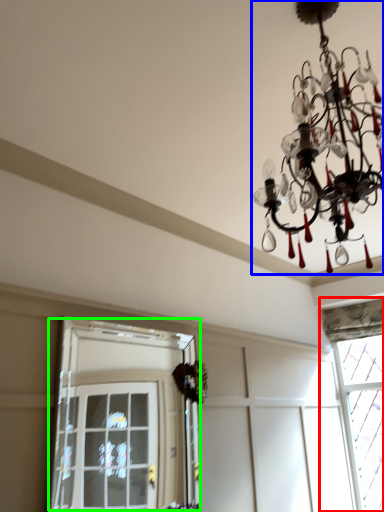
Question: Based on their relative distances, which object is nearer to window (highlighted by a red box)? Choose from lamp (highlighted by a blue box) and window (highlighted by a green box).

Choices:
 (A) lamp
 (B) window

Answer: (B)